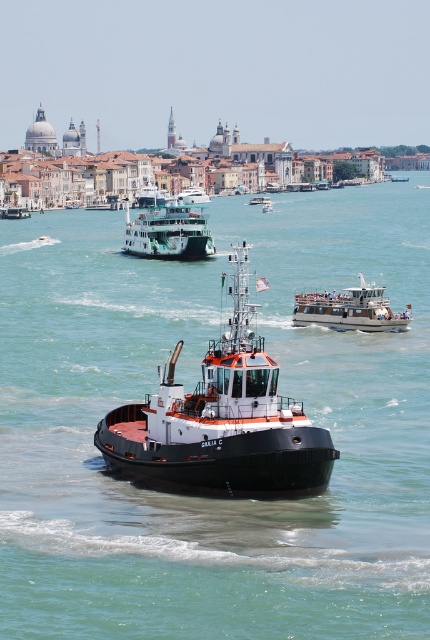
Which is behind, point (177, 237) or point (393, 180)?

The point (393, 180) is more distant.

What are the coordinates of `green matte ferry at center` in the screenshot? It's located at (168, 230).

Is point (276, 365) positioned in front of point (184, 225)?

That is True.

Image resolution: width=430 pixels, height=640 pixels. Describe the element at coordinates (221, 420) in the screenshot. I see `black rubber tugboat at center` at that location.

Locate an element on the screen. This screenshot has height=640, width=430. black rubber tugboat at center is located at coordinates (221, 420).

Can you confirm if clear blue water at center is wider than green matte ferry at center?

Correct, the width of clear blue water at center exceeds that of green matte ferry at center.

Which is in front, point (255, 637) or point (157, 237)?

Point (255, 637) is in front.

Which is in front, point (267, 337) or point (159, 230)?

Point (267, 337)

At what (x,y) coordinates should I click in order to perform the action: click on clear blue water at center. Please return your answer as a coordinate pair (x, y). Looking at the image, I should click on (190, 390).